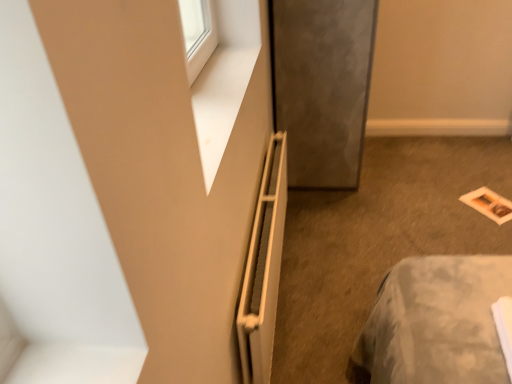
Find the location of a particular element. Image resolution: width=512 pixels, height=384 pixels. free space behind matte paper magazine at lower right is located at coordinates 465,179.